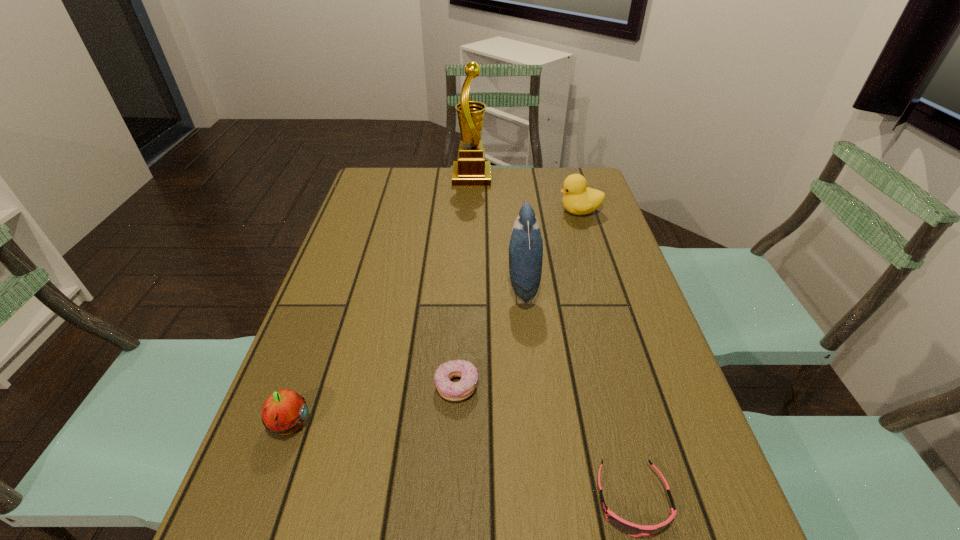
Image resolution: width=960 pixels, height=540 pixels. In order to click on object that is at the left edge in this screenshot , I will do tap(284, 411).

Where is `object present at the right edge`? The height and width of the screenshot is (540, 960). object present at the right edge is located at coordinates (579, 199).

Locate an element on the screen. This screenshot has width=960, height=540. object situated at the far right corner is located at coordinates (579, 199).

You are a GUI agent. You are given a task and a screenshot of the screen. Output one action in this format:
    pyautogui.click(x=<x>, y=<y>)
    Task: Click on the blank area at the far edge
    This screenshot has width=960, height=540.
    Given the screenshot: What is the action you would take?
    pyautogui.click(x=523, y=183)

In the image, there is a desktop. Where is `vacant space at the left edge`? This screenshot has height=540, width=960. vacant space at the left edge is located at coordinates (336, 266).

The width and height of the screenshot is (960, 540). In the image, there is a desktop. Identify the location of vacant space at the right edge. (644, 482).

This screenshot has width=960, height=540. I want to click on blank area at the far left corner, so click(405, 173).

Find the location of a particular element. vacant area between the fourth object from left to right and the third nearest object is located at coordinates (490, 336).

The image size is (960, 540). I want to click on unoccupied area between the fifth shortest object and the fourth farthest object, so click(x=490, y=336).

Identify the location of vacant point located between the award and the leftmost object. The image size is (960, 540). (380, 301).